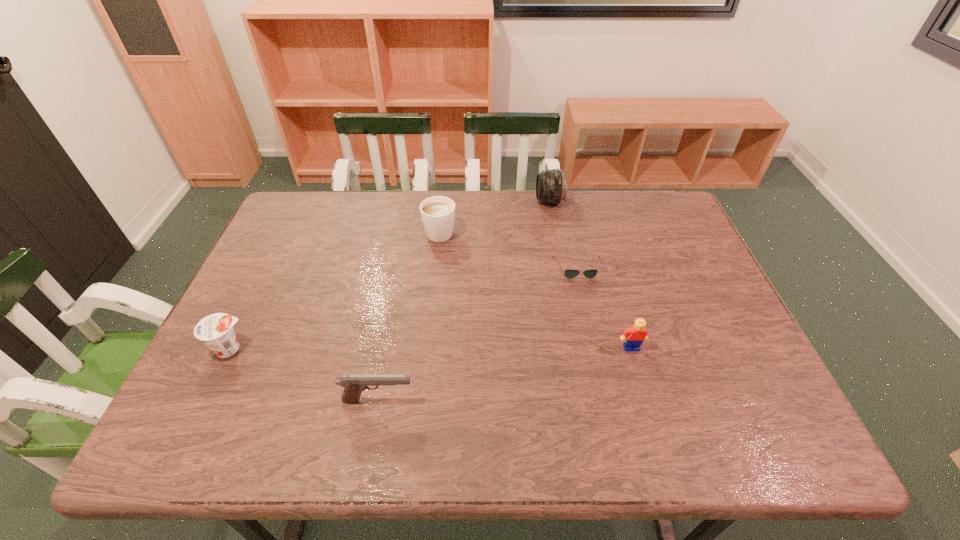
Identify the location of vacant area located at the front element of the telephoto lens. (441, 201).

Image resolution: width=960 pixels, height=540 pixels. What are the coordinates of `free point located 0.150m with the handle on the side of the cappuccino` in the screenshot? It's located at (444, 191).

Where is `vacant space located with the handle on the side of the cappuccino`? Image resolution: width=960 pixels, height=540 pixels. vacant space located with the handle on the side of the cappuccino is located at coordinates (444, 198).

This screenshot has width=960, height=540. Find the location of `free spot located on the face of the Lego`. free spot located on the face of the Lego is located at coordinates (640, 377).

This screenshot has width=960, height=540. I want to click on vacant space located at the barrel of the pistol, so click(x=581, y=401).

Locate an element on the screen. free space located on the back of the leftmost object is located at coordinates (268, 270).

You are a GUI agent. You are given a task and a screenshot of the screen. Output one action in this format:
    pyautogui.click(x=<x>, y=<y>)
    Task: Click on the free region located on the lenses of the third farthest object
    The height and width of the screenshot is (540, 960).
    Given the screenshot: What is the action you would take?
    pyautogui.click(x=592, y=334)

What are the coordinates of `telephoto lens present at the far edge` in the screenshot? It's located at (551, 186).

Locate an element on the screen. cappuccino that is positioned at the far edge is located at coordinates (437, 213).

At what (x,y) coordinates should I click in order to perform the action: click on object at the left edge. Please return your answer as a coordinate pair (x, y). This screenshot has height=540, width=960. Looking at the image, I should click on (216, 330).